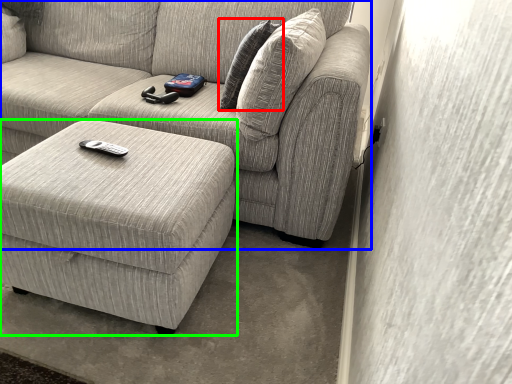
Question: Which is farther away from pillow (highlighted by a red box)? studio couch (highlighted by a blue box) or table (highlighted by a green box)?

Choices:
 (A) studio couch
 (B) table

Answer: (B)